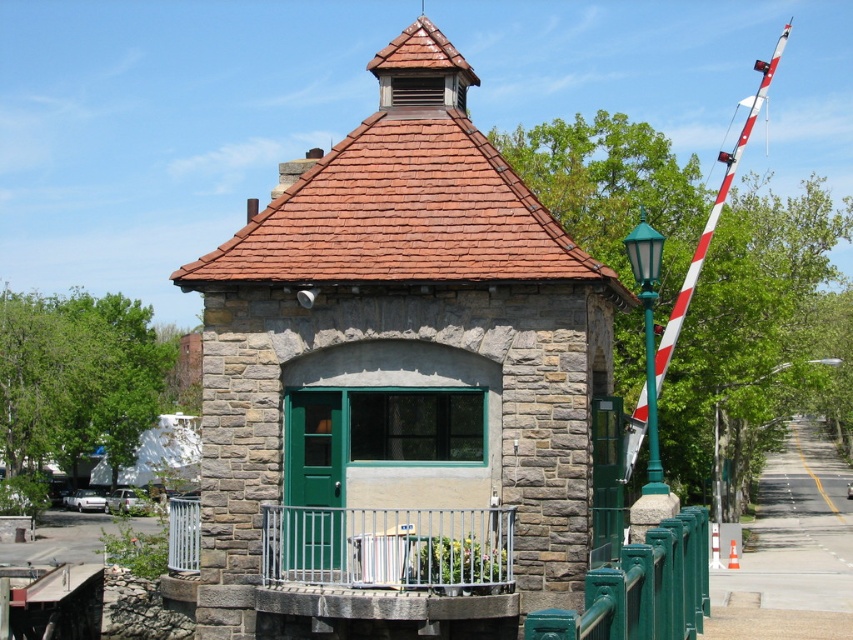
Question: Which point appears farthest from the camera in this image?

Choices:
 (A) (751, 120)
 (B) (579, 289)

Answer: (A)

Question: Can you confirm if stone gazebo at center is smaller than white/red striped pole at right?

Choices:
 (A) yes
 (B) no

Answer: (A)

Question: Is stone gazebo at center to the right of white/red striped pole at right from the viewer's perspective?

Choices:
 (A) yes
 (B) no

Answer: (B)

Question: Is stone gazebo at center behind white/red striped pole at right?

Choices:
 (A) no
 (B) yes

Answer: (A)

Question: Which point appears closest to the camera in this image?

Choices:
 (A) (642, 428)
 (B) (578, 291)

Answer: (B)